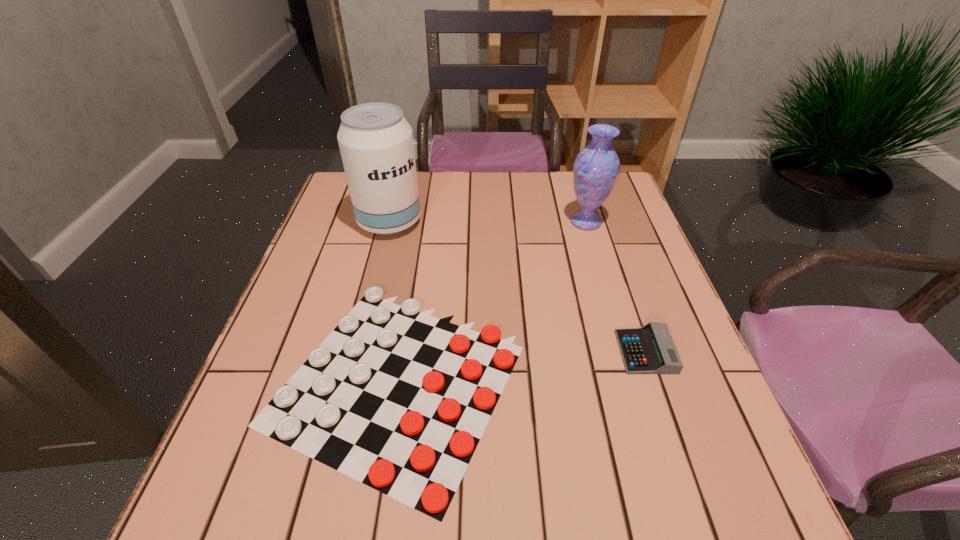
Image resolution: width=960 pixels, height=540 pixels. What are the coordinates of `vacant area between the shortest object and the second tallest object` in the screenshot? It's located at tap(492, 300).

The width and height of the screenshot is (960, 540). Find the location of `empty location between the checkerboard and the alcohol`. empty location between the checkerboard and the alcohol is located at coordinates (395, 301).

Identify the location of vacant area between the shortest object and the vase. The width and height of the screenshot is (960, 540). (492, 300).

At what (x,y) coordinates should I click in order to perform the action: click on the third closest object to the third tallest object. Please return your answer as a coordinate pair (x, y). Image resolution: width=960 pixels, height=540 pixels. Looking at the image, I should click on (375, 140).

Point out which object is positioned as the third nearest to the shortest object. Please provide its 2D coordinates. Your answer should be formatted as a tuple, i.e. [(x, y)], where the tuple contains the x and y coordinates of a point satisfying the conditions above.

[(595, 170)]

Find the location of a particular element. vacant space that satisfies the following two spatial constraints: 1. on the front side of the checkerboard; 2. on the right side of the alcohol is located at coordinates (349, 379).